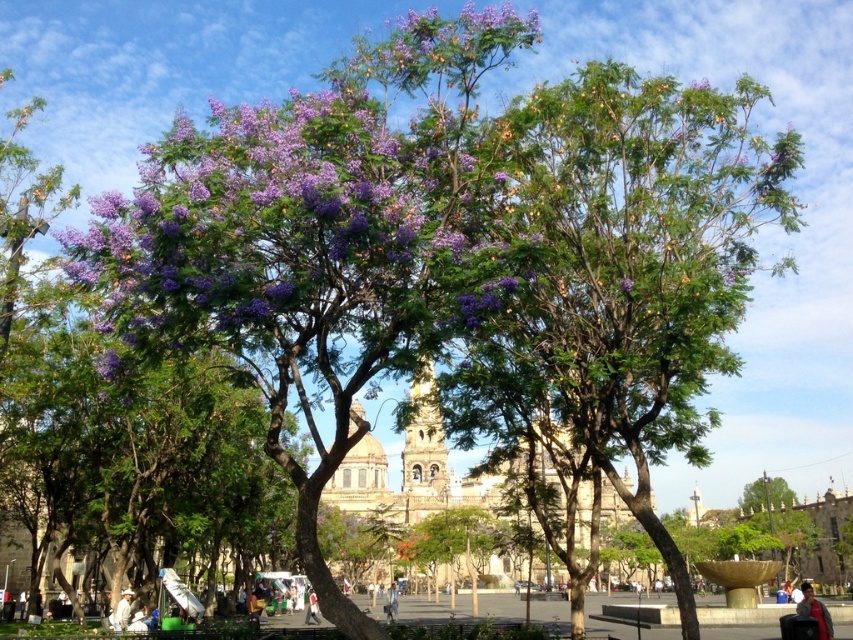
You are standing in the urban park scene described. You notice a red fabric jacket at lower right. Where exactly is the red fabric jacket located in relation to the point marked at coordinates point (815, 611)?

The red fabric jacket at lower right is located exactly at point (815, 611).

You are standing at the camera position in the park and want to reach the white fabric at center. The path is clear, but you have a 100 meter limit on how far you can walk. Can you reach it within your limit?

The white fabric at center is 116.61 meters away from the camera, which exceeds your 100 meter walking limit. You cannot reach it within the allowed distance.

You are standing in the urban park scene and want to walk from the point at coordinates point (125,602) to the point at coordinates point (308,612). Which direction should you move to get closer to your destination?

To move from point (125,602) to point (308,612), you should move upwards because point (125,602) is in front of point (308,612), indicating it is closer to the viewer and the destination is behind it.